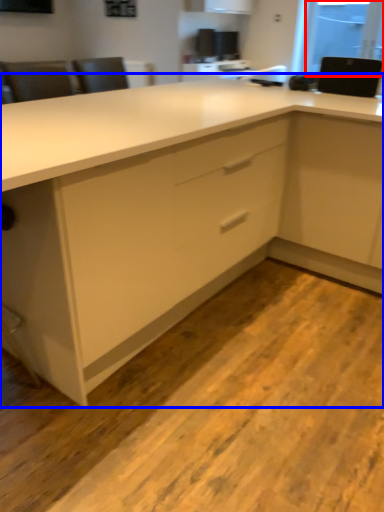
Question: Which object appears closest to the camera in this image, window screen (highlighted by a red box) or cabinetry (highlighted by a blue box)?

Choices:
 (A) window screen
 (B) cabinetry

Answer: (B)